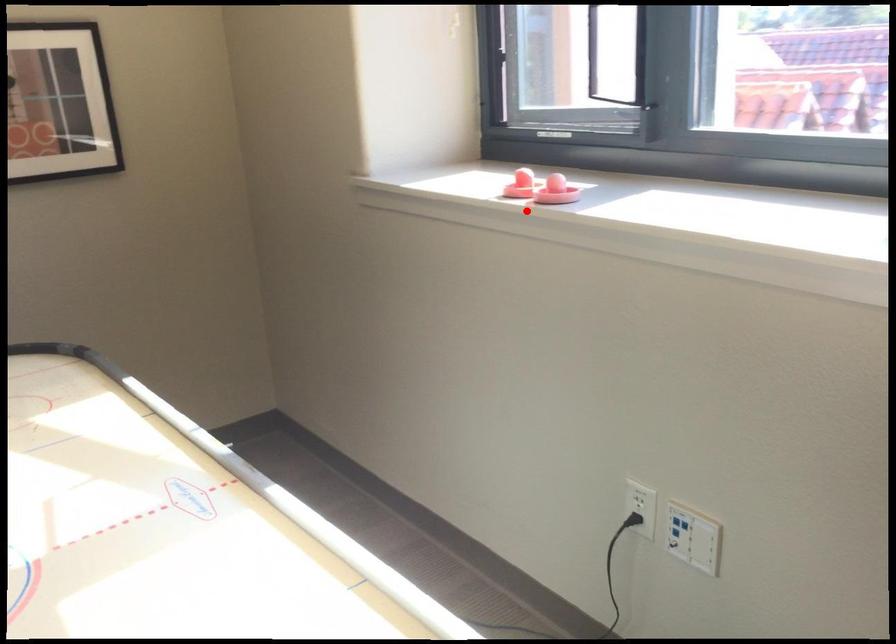
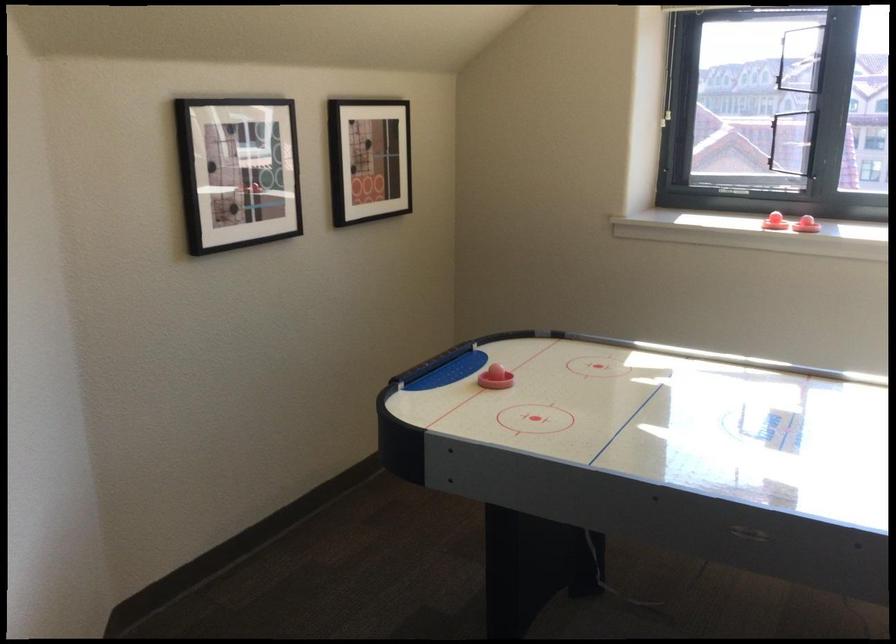
Question: I am providing you with two images of the same scene from different viewpoints. In image1, a red point is highlighted. Considering the same 3D point in image2, which of the following is correct?

Choices:
 (A) It is closer
 (B) It is farther

Answer: (B)